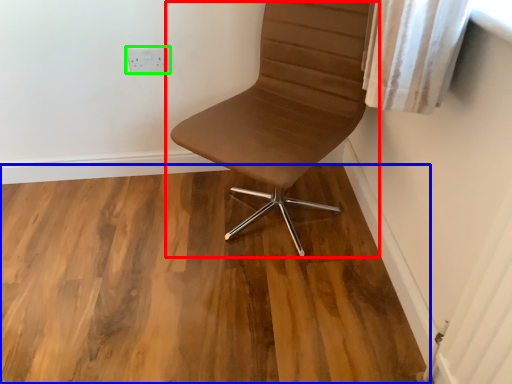
Question: Which object is positioned farthest from chair (highlighted by a red box)? Select from hardwood (highlighted by a blue box) and electric outlet (highlighted by a green box).

Choices:
 (A) hardwood
 (B) electric outlet

Answer: (B)